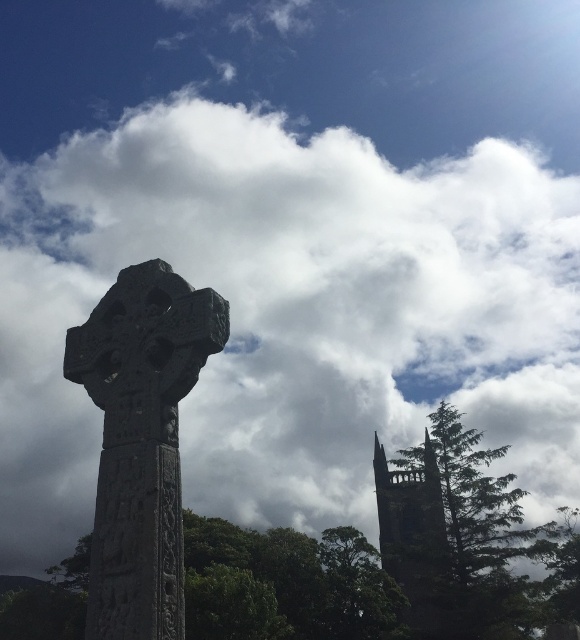
You are standing at the base of the large stone Celtic cross and want to take a photo of the dark church tower in the background. To avoid blocking the view, you need to move to a spot where the green textured tree at center won

The green textured tree at center is located at coordinates point (288, 584), so moving to a position that is not obstructed by this tree would allow you to capture the church tower without any obstruction.

You are standing in the outdoor scene and want to take a photo of the dark gray stone tower at right. There is a green textured tree at center blocking part of your view. Which direction should you move to avoid the tree?

You should move to the right side of the green textured tree at center to avoid it blocking the view of the dark gray stone tower at right since the tree is on the left side of the tower.

You are a landscape architect planning to place a new statue between the green textured tree at center and the dark gray stone tower at right. Based on their sizes, which object should the statue be closer to for visual balance?

The green textured tree at center is larger than the dark gray stone tower at right, so the statue should be placed closer to the smaller dark gray stone tower at right to achieve visual balance.